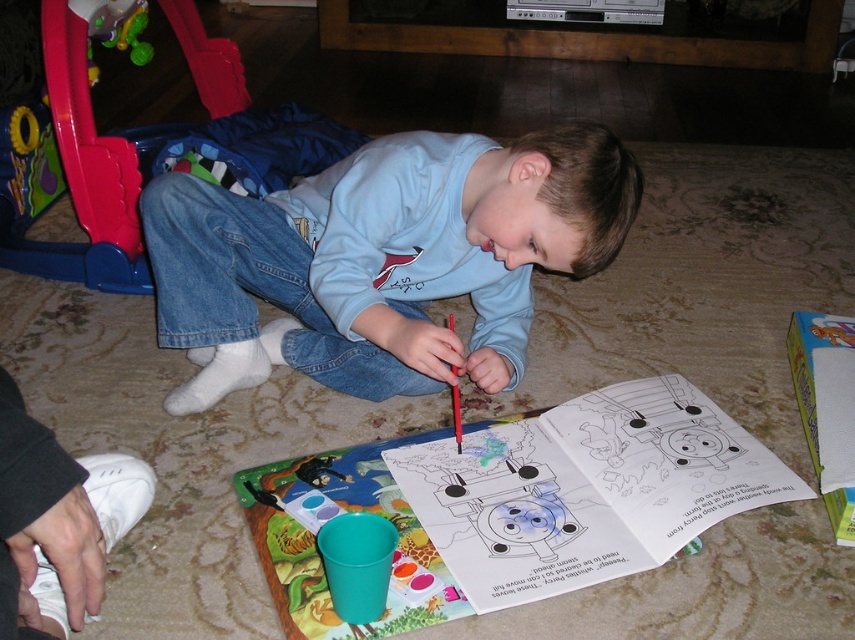
Which is above, light blue cotton shirt at center or matte plastic crayon at lower center?

light blue cotton shirt at center

Locate an element on the screen. light blue cotton shirt at center is located at coordinates (382, 259).

This screenshot has width=855, height=640. Identify the location of light blue cotton shirt at center. (382, 259).

Measure the distance between light blue cotton shirt at center and camera.

The distance of light blue cotton shirt at center from camera is 4.04 feet.

Who is more forward, (410, 362) or (81, 262)?

Point (410, 362) is in front.

Is point (402, 358) in front of point (234, 131)?

Yes, point (402, 358) is closer to viewer.

Where is `light blue cotton shirt at center`? This screenshot has width=855, height=640. light blue cotton shirt at center is located at coordinates (382, 259).

Which is more to the right, matte plastic coloring book at center or rubberized plastic walker at left?

matte plastic coloring book at center

Does matte plastic coloring book at center have a lesser height compared to rubberized plastic walker at left?

Correct, matte plastic coloring book at center is not as tall as rubberized plastic walker at left.

The image size is (855, 640). I want to click on matte plastic coloring book at center, so click(x=513, y=502).